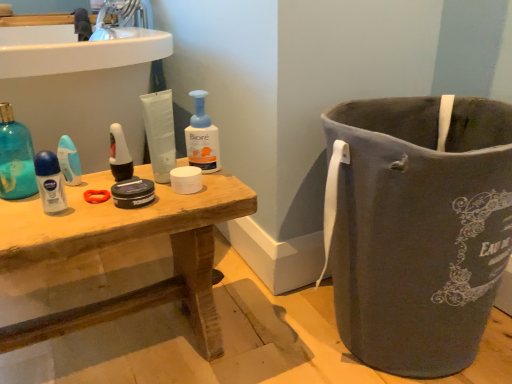
Where is `matte white shaving cream at left`? matte white shaving cream at left is located at coordinates (50, 182).

What do you see at coordinates (122, 241) in the screenshot?
I see `wooden table at center` at bounding box center [122, 241].

What do you see at coordinates (202, 137) in the screenshot? The image size is (512, 384). I see `translucent plastic pump bottle at center, which ranks as the second cleaning product in left-to-right order` at bounding box center [202, 137].

What is the approximate width of translucent plastic deodorant stick at left, which ranks as the 1th cleaning product in left-to-right order?

translucent plastic deodorant stick at left, which ranks as the 1th cleaning product in left-to-right order, is 9.03 centimeters wide.

At what (x,y) coordinates should I click in order to perform the action: click on white glossy sink at upper left. Please return your answer as a coordinate pair (x, y). Looking at the image, I should click on 75,50.

Where is `matte white shaving cream at left`? matte white shaving cream at left is located at coordinates (50, 182).

Does wooden table at center have a smaller size compared to white matte toilet paper at center?

Incorrect, wooden table at center is not smaller in size than white matte toilet paper at center.

From the image's perspective, is wooden table at center located above or below white matte toilet paper at center?

Clearly, from the image's perspective, wooden table at center is below white matte toilet paper at center.

Can you confirm if translucent plastic deodorant stick at left, which ranks as the 1th cleaning product in left-to-right order, is wider than matte white shaving cream at left?

Yes, translucent plastic deodorant stick at left, which ranks as the 1th cleaning product in left-to-right order, is wider than matte white shaving cream at left.

Does translucent plastic deodorant stick at left, which ranks as the 1th cleaning product in left-to-right order, have a greater height compared to matte white shaving cream at left?

Yes.

Considering the relative positions of translucent plastic deodorant stick at left, which ranks as the 2th cleaning product in right-to-left order, and matte white shaving cream at left in the image provided, is translucent plastic deodorant stick at left, which ranks as the 2th cleaning product in right-to-left order, to the left of matte white shaving cream at left from the viewer's perspective?

Yes, translucent plastic deodorant stick at left, which ranks as the 2th cleaning product in right-to-left order, is to the left of matte white shaving cream at left.

Is translucent plastic deodorant stick at left, which ranks as the 2th cleaning product in right-to-left order, facing towards matte white shaving cream at left?

No, translucent plastic deodorant stick at left, which ranks as the 2th cleaning product in right-to-left order, is not oriented towards matte white shaving cream at left.

Is matte white shaving cream at left bigger or smaller than translucent plastic deodorant stick at left, which ranks as the 2th cleaning product in right-to-left order?

matte white shaving cream at left is smaller than translucent plastic deodorant stick at left, which ranks as the 2th cleaning product in right-to-left order.

Locate an element on the screen. cleaning product to the left of matte white shaving cream at left is located at coordinates (15, 157).

Is matte white shaving cream at left far away from translucent plastic deodorant stick at left, which ranks as the 1th cleaning product in left-to-right order?

No, there isn't a large distance between matte white shaving cream at left and translucent plastic deodorant stick at left, which ranks as the 1th cleaning product in left-to-right order.

Which object is further away from the camera taking this photo, translucent plastic pump bottle at center, which ranks as the second cleaning product in left-to-right order, or matte white shaving cream at left?

Positioned behind is translucent plastic pump bottle at center, which ranks as the second cleaning product in left-to-right order.

Locate an element on the screen. Image resolution: width=512 pixels, height=384 pixels. cleaning product to the right of matte white shaving cream at left is located at coordinates (202, 137).

Is translucent plastic pump bottle at center, which ranks as the second cleaning product in left-to-right order, situated inside matte white shaving cream at left or outside?

translucent plastic pump bottle at center, which ranks as the second cleaning product in left-to-right order, is spatially situated outside matte white shaving cream at left.

From a real-world perspective, which object rests below the other?

From a 3D spatial view, wooden table at center is below.

Considering the sizes of objects white glossy sink at upper left and wooden table at center in the image provided, who is wider, white glossy sink at upper left or wooden table at center?

wooden table at center.

Consider the image. From the image's perspective, is white glossy sink at upper left on wooden table at center?

Indeed, from the image's perspective, white glossy sink at upper left is shown above wooden table at center.

Who is taller, white glossy sink at upper left or wooden table at center?

Standing taller between the two is wooden table at center.

Identify the location of cleaning product that is the 1st one below the white glossy sink at upper left (from a real-world perspective). The image size is (512, 384). (15, 157).

Considering the sizes of white glossy sink at upper left and translucent plastic deodorant stick at left, which ranks as the 1th cleaning product in left-to-right order, in the image, is white glossy sink at upper left wider or thinner than translucent plastic deodorant stick at left, which ranks as the 1th cleaning product in left-to-right order,?

In the image, white glossy sink at upper left appears to be wider than translucent plastic deodorant stick at left, which ranks as the 1th cleaning product in left-to-right order.

Is the position of white glossy sink at upper left more distant than that of translucent plastic deodorant stick at left, which ranks as the 2th cleaning product in right-to-left order?

Yes, it is.

Is white glossy sink at upper left bigger than translucent plastic deodorant stick at left, which ranks as the 2th cleaning product in right-to-left order?

Yes.

Looking at this image, can you confirm if matte white shaving cream at left is shorter than translucent plastic pump bottle at center, which ranks as the second cleaning product in left-to-right order?

Correct, matte white shaving cream at left is not as tall as translucent plastic pump bottle at center, which ranks as the second cleaning product in left-to-right order.

Considering the relative sizes of matte white shaving cream at left and translucent plastic pump bottle at center, the 1th cleaning product from the right, in the image provided, is matte white shaving cream at left smaller than translucent plastic pump bottle at center, the 1th cleaning product from the right,?

Yes, matte white shaving cream at left is smaller than translucent plastic pump bottle at center, the 1th cleaning product from the right.

Can you confirm if matte white shaving cream at left is positioned to the left of translucent plastic pump bottle at center, the 1th cleaning product from the right?

Yes.

Consider the image. Which object is thinner, matte white shaving cream at left or translucent plastic pump bottle at center, which ranks as the second cleaning product in left-to-right order?

translucent plastic pump bottle at center, which ranks as the second cleaning product in left-to-right order.

Locate an element on the screen. The width and height of the screenshot is (512, 384). toilet paper behind the wooden table at center is located at coordinates (186, 179).

Identify the location of shaving cream lying below the translucent plastic deodorant stick at left, which ranks as the 1th cleaning product in left-to-right order (from the image's perspective). (50, 182).

From the image, which object appears to be nearer to white matte toothbrush at center, wooden table at center or white matte toilet paper at center?

white matte toilet paper at center lies closer to white matte toothbrush at center than the other object.

Estimate the real-world distances between objects in this image. Which object is closer to white glossy sink at upper left, white matte toothbrush at center or wooden table at center?

white matte toothbrush at center is positioned closer to the anchor white glossy sink at upper left.

Looking at this image, which object lies nearer to the anchor point white matte toothbrush at center, white glossy sink at upper left or translucent plastic pump bottle at center, the 1th cleaning product from the right?

The object closer to white matte toothbrush at center is translucent plastic pump bottle at center, the 1th cleaning product from the right.

Estimate the real-world distances between objects in this image. Which object is further from white glossy sink at upper left, matte white shaving cream at left or blue plastic razor at center?

matte white shaving cream at left lies further to white glossy sink at upper left than the other object.

Estimate the real-world distances between objects in this image. Which object is closer to white glossy sink at upper left, matte white shaving cream at left or wooden table at center?

Among the two, matte white shaving cream at left is located nearer to white glossy sink at upper left.

Considering their positions, is matte white shaving cream at left positioned closer to white matte toothbrush at center than translucent plastic pump bottle at center, which ranks as the second cleaning product in left-to-right order?

The object closer to white matte toothbrush at center is matte white shaving cream at left.

Based on their spatial positions, is white glossy sink at upper left or translucent plastic deodorant stick at left, which ranks as the 1th cleaning product in left-to-right order, further from matte white shaving cream at left?

white glossy sink at upper left is positioned further to the anchor matte white shaving cream at left.

Which object lies further to the anchor point translucent plastic deodorant stick at left, which ranks as the 2th cleaning product in right-to-left order, matte white shaving cream at left or white glossy sink at upper left?

white glossy sink at upper left is positioned further to the anchor translucent plastic deodorant stick at left, which ranks as the 2th cleaning product in right-to-left order.

The width and height of the screenshot is (512, 384). What are the coordinates of `mouthwash located between wooden table at center and white glossy sink at upper left in the depth direction` in the screenshot? It's located at (119, 155).

I want to click on cleaning product between white matte toothbrush at center and white glossy sink at upper left from front to back, so click(202, 137).

At what (x,y) coordinates should I click in order to perform the action: click on shaving cream between translucent plastic deodorant stick at left, which ranks as the 1th cleaning product in left-to-right order, and wooden table at center vertically. Please return your answer as a coordinate pair (x, y). The image size is (512, 384). Looking at the image, I should click on (50, 182).

In order to click on toilet paper between matte white shaving cream at left and white glossy sink at upper left in the front-back direction in this screenshot , I will do click(186, 179).